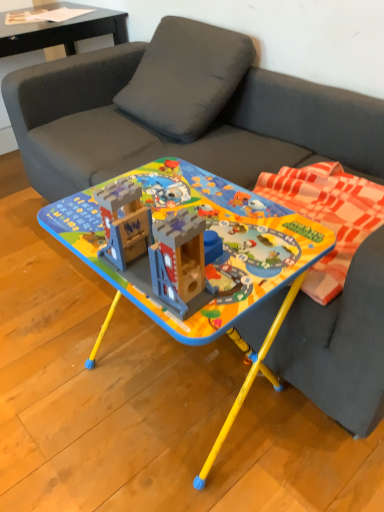
Locate an element on the screen. free spot below matte plastic table at center, positioned as the 2th table in left-to-right order (from a real-world perspective) is located at coordinates (175, 384).